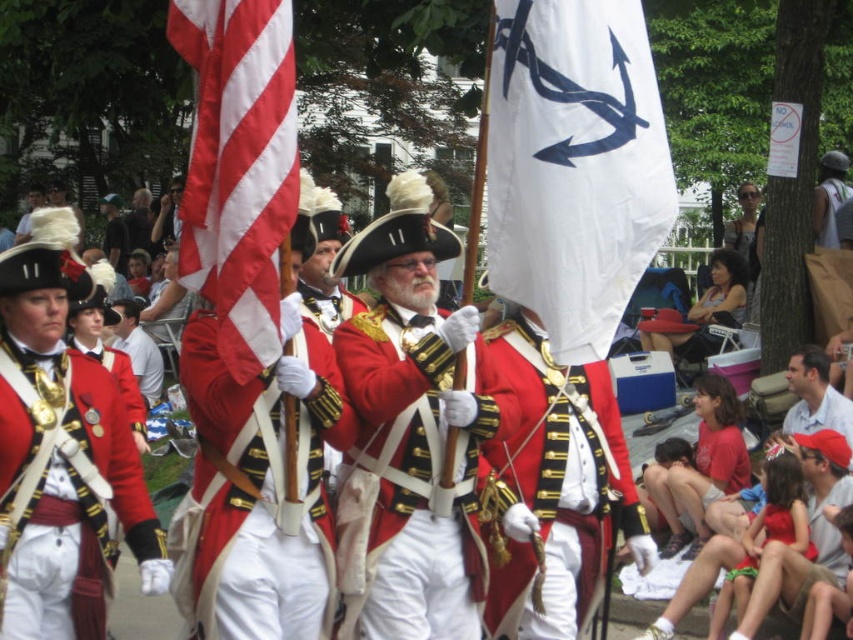
Question: Which of the following is the farthest from the observer?

Choices:
 (A) (508, 298)
 (B) (329, 420)

Answer: (A)

Question: Which point is closer to the camera?

Choices:
 (A) matte gold chain at center
 (B) red/white striped fabric at left
 (C) shiny gold buttons at center
 (D) light blue shirt at lower right

Answer: (B)

Question: Which object appears farthest from the camera in this image?

Choices:
 (A) shiny red fabric at center
 (B) shiny gold buttons at center
 (C) matte gold chain at center
 (D) shiny gold medallion at center

Answer: (D)

Question: Does shiny red fabric uniform at center lie behind matte gold chain at center?

Choices:
 (A) yes
 (B) no

Answer: (A)

Question: Can you confirm if shiny gold buttons at center is wider than matte gold chain at center?

Choices:
 (A) no
 (B) yes

Answer: (B)

Question: Where is shiny gold buttons at center located in relation to matte gold chain at center in the image?

Choices:
 (A) right
 (B) left

Answer: (A)